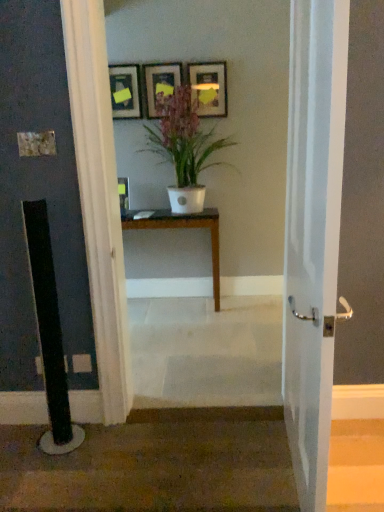
Question: Is matte gold picture frame at upper center, marked as the third picture frame in a left-to-right arrangement, in front of wooden table at center?

Choices:
 (A) yes
 (B) no

Answer: (B)

Question: Is matte gold picture frame at upper center, acting as the first picture frame starting from the right, not within wooden table at center?

Choices:
 (A) yes
 (B) no

Answer: (A)

Question: From a real-world perspective, is matte gold picture frame at upper center, acting as the first picture frame starting from the right, positioned under wooden table at center based on gravity?

Choices:
 (A) yes
 (B) no

Answer: (B)

Question: Is matte gold picture frame at upper center, acting as the first picture frame starting from the right, bigger than wooden table at center?

Choices:
 (A) yes
 (B) no

Answer: (B)

Question: Is matte gold picture frame at upper center, marked as the third picture frame in a left-to-right arrangement, to the left of wooden table at center from the viewer's perspective?

Choices:
 (A) no
 (B) yes

Answer: (A)

Question: Is matte gold picture frame at upper center, acting as the first picture frame starting from the right, wider than wooden table at center?

Choices:
 (A) no
 (B) yes

Answer: (A)

Question: Can you confirm if matte gold picture frame at upper center, marked as the third picture frame in a left-to-right arrangement, is positioned to the right of brown carpet at lower left?

Choices:
 (A) no
 (B) yes

Answer: (B)

Question: Can you confirm if matte gold picture frame at upper center, marked as the third picture frame in a left-to-right arrangement, is wider than brown carpet at lower left?

Choices:
 (A) yes
 (B) no

Answer: (B)

Question: Does matte gold picture frame at upper center, acting as the first picture frame starting from the right, come behind brown carpet at lower left?

Choices:
 (A) yes
 (B) no

Answer: (A)

Question: Is the position of matte gold picture frame at upper center, marked as the third picture frame in a left-to-right arrangement, less distant than that of brown carpet at lower left?

Choices:
 (A) no
 (B) yes

Answer: (A)

Question: Is matte gold picture frame at upper center, marked as the third picture frame in a left-to-right arrangement, looking in the opposite direction of brown carpet at lower left?

Choices:
 (A) no
 (B) yes

Answer: (A)

Question: Is brown carpet at lower left a part of matte gold picture frame at upper center, acting as the first picture frame starting from the right?

Choices:
 (A) no
 (B) yes

Answer: (A)

Question: From the image's perspective, is white glossy door at center below matte wooden picture frame at upper center, acting as the second picture frame starting from the right?

Choices:
 (A) no
 (B) yes

Answer: (B)